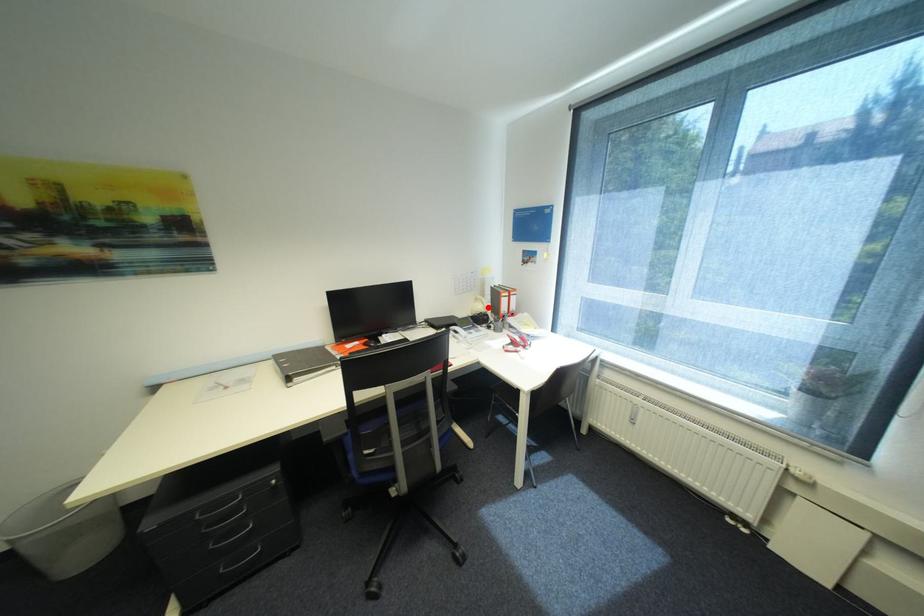
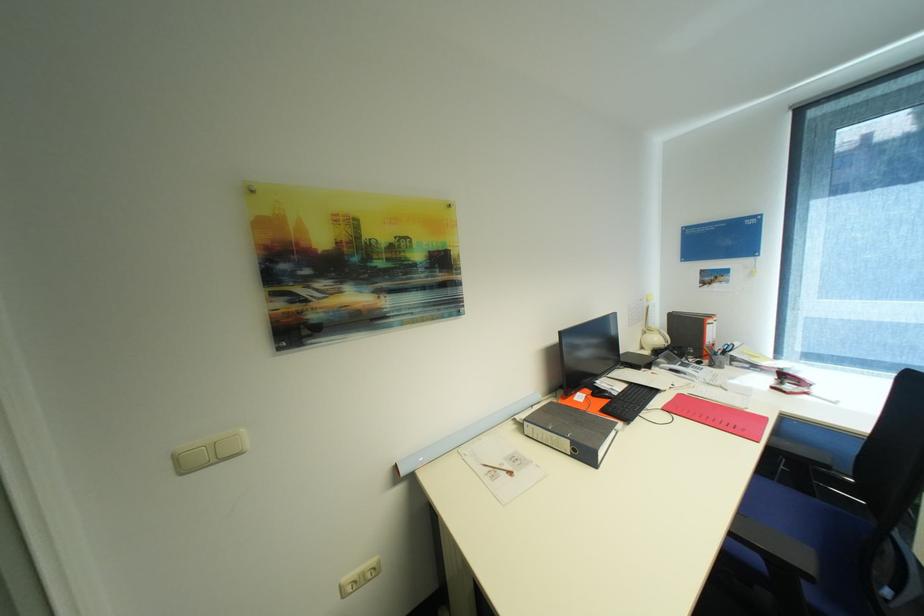
Where in the second image is the point corresponding to the highlighted location from the first image?

(663, 339)